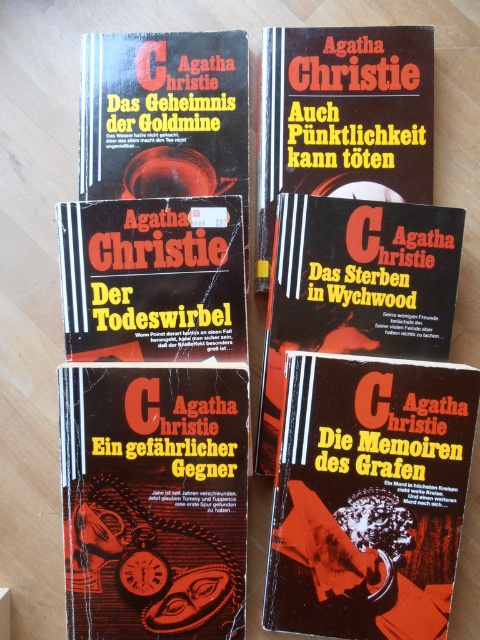
Question: Which of the following is the closest to the observer?

Choices:
 (A) (286, 212)
 (B) (98, 355)
 (C) (156, 474)
 (D) (357, 186)

Answer: (C)

Question: Is matte black clock at center behind matte black book cover at center?

Choices:
 (A) no
 (B) yes

Answer: (A)

Question: Where is matte black clock at center located in relation to matte black book cover at center in the image?

Choices:
 (A) above
 (B) below

Answer: (B)

Question: Among these points, which one is nearest to the camera?

Choices:
 (A) (146, 275)
 (B) (305, 67)

Answer: (B)

Question: Is dark red paper at center thinner than matte black book cover at upper center?

Choices:
 (A) no
 (B) yes

Answer: (A)

Question: Which point appears closest to the camera in this image?

Choices:
 (A) (411, 614)
 (B) (184, 310)
 (C) (104, 451)

Answer: (A)